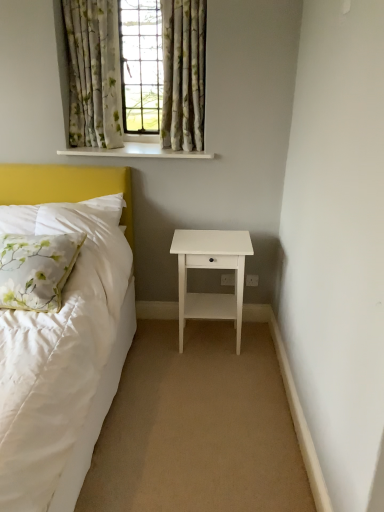
Question: Is white glossy nightstand at lower right positioned with its back to floral fabric curtains at upper center, which ranks as the second curtain in left-to-right order?

Choices:
 (A) no
 (B) yes

Answer: (A)

Question: Can you confirm if white glossy nightstand at lower right is positioned to the left of floral fabric curtains at upper center, which ranks as the second curtain in left-to-right order?

Choices:
 (A) no
 (B) yes

Answer: (A)

Question: From the image's perspective, would you say white glossy nightstand at lower right is shown under floral fabric curtains at upper center, which appears as the 1th curtain when viewed from the right?

Choices:
 (A) yes
 (B) no

Answer: (A)

Question: Is white glossy nightstand at lower right to the right of floral fabric curtains at upper center, which appears as the 1th curtain when viewed from the right, from the viewer's perspective?

Choices:
 (A) no
 (B) yes

Answer: (B)

Question: Does white glossy nightstand at lower right have a smaller size compared to floral fabric curtains at upper center, which ranks as the second curtain in left-to-right order?

Choices:
 (A) no
 (B) yes

Answer: (A)

Question: From a real-world perspective, relative to floral fabric curtains at upper center, which ranks as the second curtain in left-to-right order, is beige carpet at lower center vertically above or below?

Choices:
 (A) below
 (B) above

Answer: (A)

Question: Does point (238, 453) appear closer or farther from the camera than point (182, 60)?

Choices:
 (A) closer
 (B) farther

Answer: (A)

Question: In the image, is beige carpet at lower center positioned in front of or behind floral fabric curtains at upper center, which appears as the 1th curtain when viewed from the right?

Choices:
 (A) behind
 (B) front

Answer: (B)

Question: Is beige carpet at lower center situated inside floral fabric curtains at upper center, which appears as the 1th curtain when viewed from the right, or outside?

Choices:
 (A) inside
 (B) outside

Answer: (B)

Question: From their relative heights in the image, would you say floral fabric curtain at upper center is taller or shorter than beige carpet at lower center?

Choices:
 (A) tall
 (B) short

Answer: (A)

Question: Does point (200, 5) appear closer or farther from the camera than point (203, 348)?

Choices:
 (A) closer
 (B) farther

Answer: (A)

Question: Considering their positions, is floral fabric curtain at upper center located in front of or behind beige carpet at lower center?

Choices:
 (A) front
 (B) behind

Answer: (B)

Question: Considering the relative positions of floral fabric curtain at upper center and beige carpet at lower center in the image provided, is floral fabric curtain at upper center to the left or to the right of beige carpet at lower center?

Choices:
 (A) right
 (B) left

Answer: (A)

Question: From the image's perspective, is white glossy nightstand at lower right positioned above or below white glossy window sill at upper center?

Choices:
 (A) above
 (B) below

Answer: (B)

Question: Is point (246, 244) closer or farther from the camera than point (178, 157)?

Choices:
 (A) closer
 (B) farther

Answer: (A)